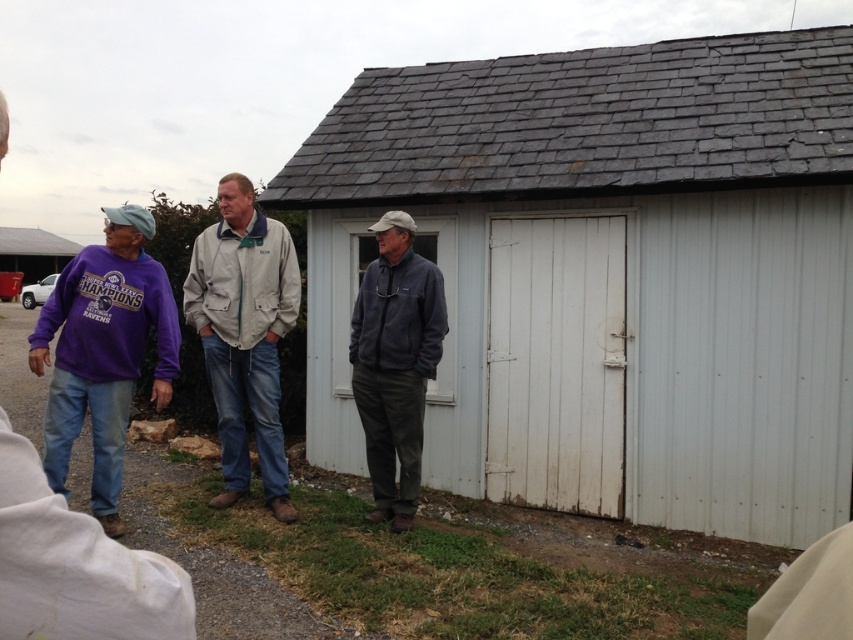
You are trying to decide which jacket to take for a cold day. Both the light beige jacket at center and the dark gray fleece jacket at center are available. Which one is bigger and thus warmer?

The light beige jacket at center has a larger size compared to the dark gray fleece jacket at center, so it would be warmer.

You are a painter who needs to paint the white wood shed at center and the light beige jacket at center. Since you can only paint one at a time, which one should you paint first if you want to start with the taller object?

The white wood shed at center is taller than the light beige jacket at center, so you should paint the white wood shed at center first.

You are trying to determine the spatial relationship between the white wood shed at center and the light beige jacket at center. Based on the scene description, which object is positioned higher from the ground?

The white wood shed at center is positioned higher from the ground than the light beige jacket at center, as the shed is described as being above the jacket.